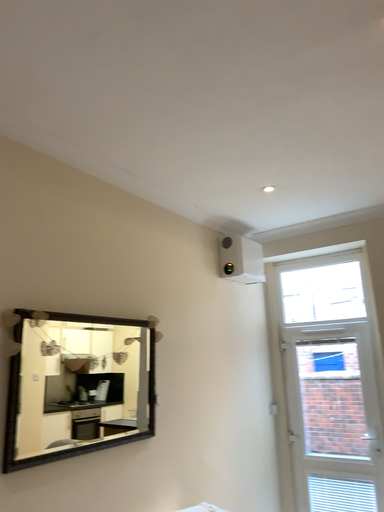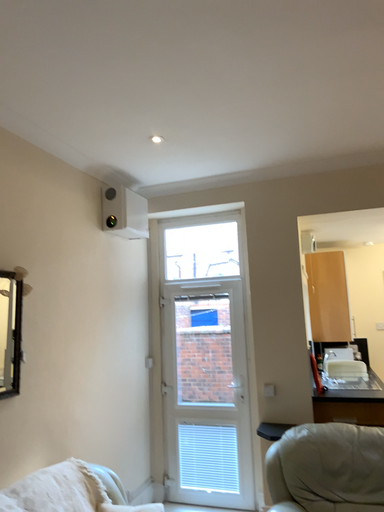
Question: How did the camera likely rotate when shooting the video?

Choices:
 (A) rotated right
 (B) rotated left

Answer: (A)